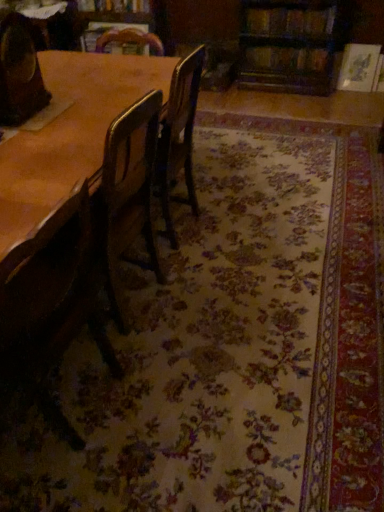
Question: From a real-world perspective, is hardcover book at upper right, the first book in the right-to-left sequence, above or below hardcover book at upper center, which is counted as the third book, starting from the right?

Choices:
 (A) above
 (B) below

Answer: (B)

Question: Is point (253, 64) closer or farther from the camera than point (104, 3)?

Choices:
 (A) closer
 (B) farther

Answer: (B)

Question: Which is farther from the wooden table at center?

Choices:
 (A) wooden chair at left, acting as the 2th chair starting from the top
 (B) hardcover book at upper center, the 2th book positioned from the left
 (C) wooden chair at left, which is the second chair in bottom-to-top order
 (D) hardcover book at upper center, positioned as the first book in left-to-right order
 (E) hardcover book at upper right, the first book in the right-to-left sequence

Answer: (E)

Question: Considering the real-world distances, which object is farthest from the wooden table at center?

Choices:
 (A) wooden chair at left, which is the first chair in top-to-bottom order
 (B) hardcover book at upper center, which is counted as the second book, starting from the right
 (C) wooden chair at left, acting as the 2th chair starting from the top
 (D) hardcover book at upper right, acting as the third book starting from the left
 (E) hardcover book at upper center, the first book positioned from the top

Answer: (D)